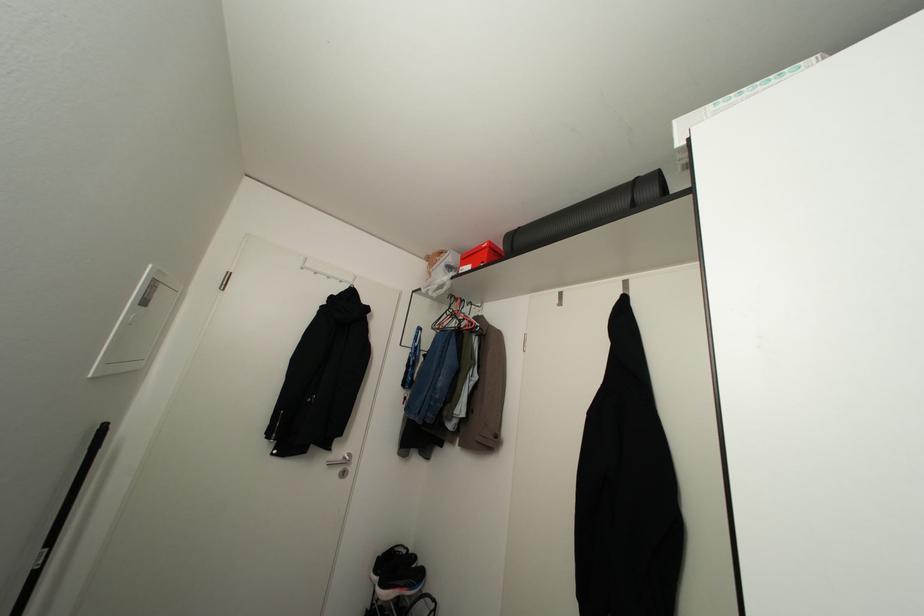
This screenshot has height=616, width=924. I want to click on long black pole, so click(58, 521).